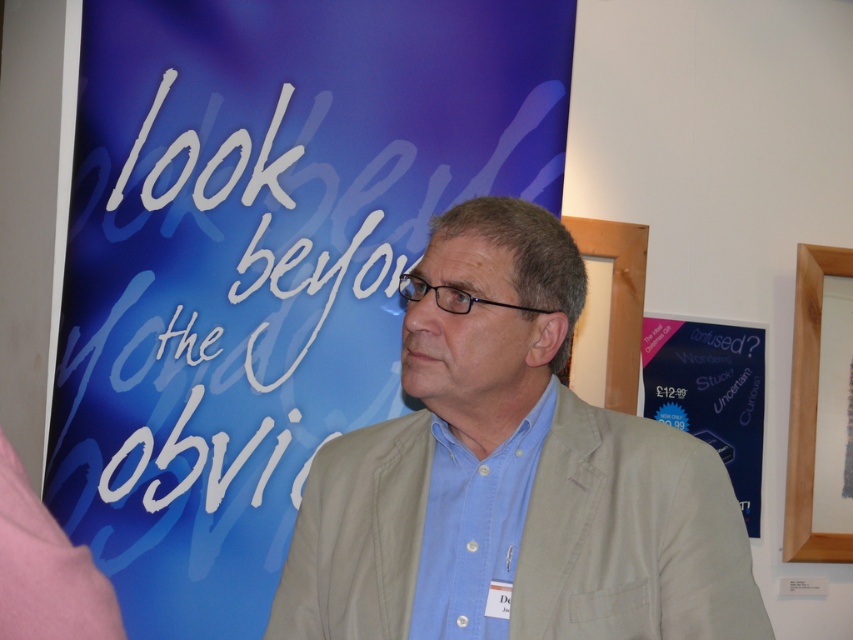
Question: Among these objects, which one is farthest from the camera?

Choices:
 (A) blue cotton shirt at center
 (B) wooden frame at upper right
 (C) beige fabric jacket at center

Answer: (B)

Question: Which point is farther from the camera taking this photo?

Choices:
 (A) (630, 385)
 (B) (712, 333)
 (C) (544, 388)

Answer: (B)

Question: Can you confirm if beige fabric jacket at center is positioned above blue paper at upper right?

Choices:
 (A) yes
 (B) no

Answer: (A)

Question: Is blue fabric poster at upper left to the left of blue paper at upper right from the viewer's perspective?

Choices:
 (A) no
 (B) yes

Answer: (B)

Question: Which point is farther to the camera?

Choices:
 (A) blue cotton shirt at center
 (B) wooden frame at upper right

Answer: (B)

Question: Does blue fabric poster at upper left appear on the right side of blue paper at upper right?

Choices:
 (A) yes
 (B) no

Answer: (B)